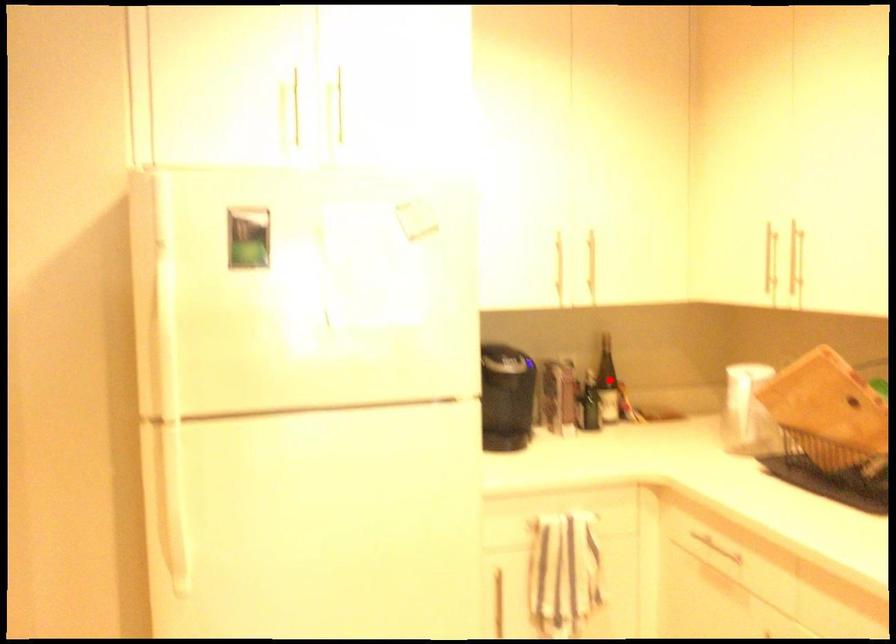
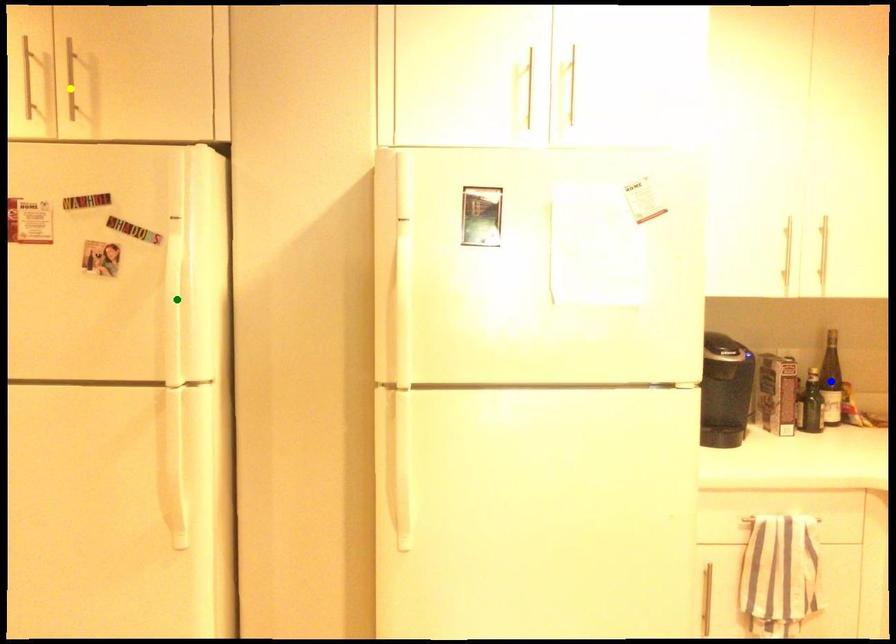
Question: I am providing you with two images of the same scene from different viewpoints. A red point is marked on the first image. You are given multiple points on the second image. Can you choose the point in image 2 that corresponds to the point in image 1?

Choices:
 (A) yellow point
 (B) blue point
 (C) green point

Answer: (B)